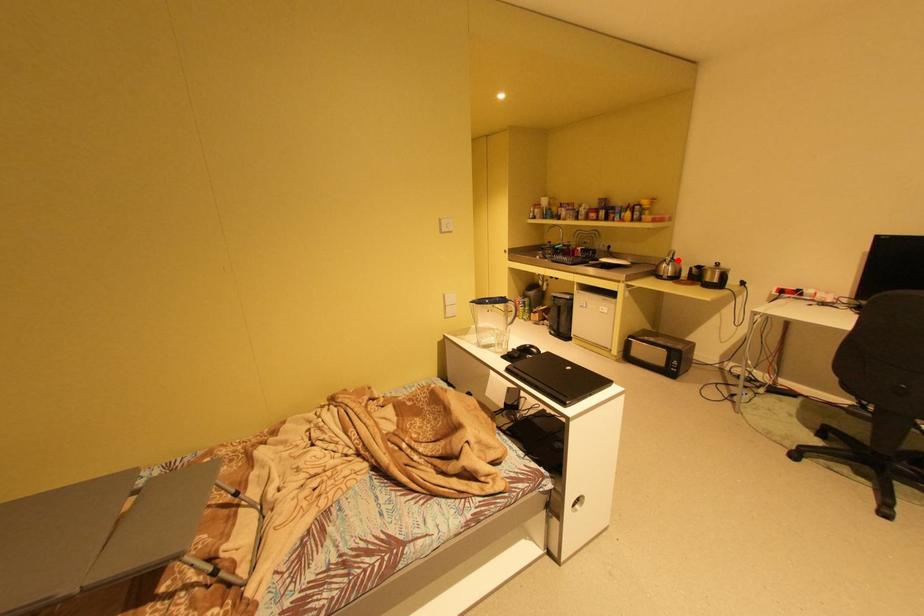
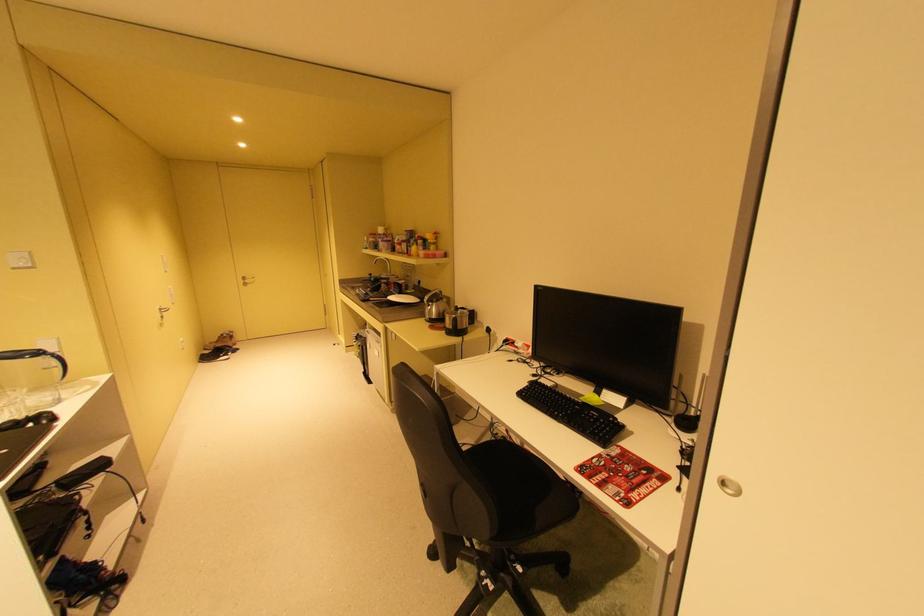
Question: I am providing you with two images of the same scene from different viewpoints. A red point is marked on the first image. Is the red point's position out of view in image 2?

Choices:
 (A) Yes
 (B) No

Answer: (B)